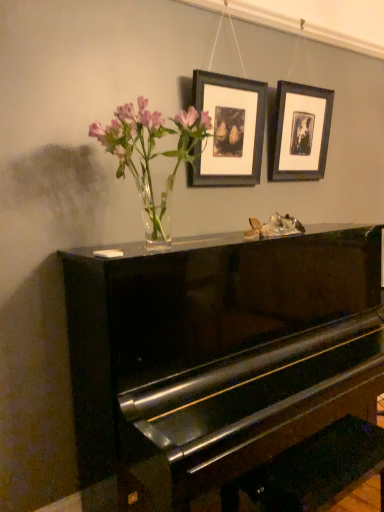
Where is `free region under matte black picture frame at upper center, the first picture frame from the front (from a real-world perspective)`? Image resolution: width=384 pixels, height=512 pixels. free region under matte black picture frame at upper center, the first picture frame from the front (from a real-world perspective) is located at coordinates (224, 231).